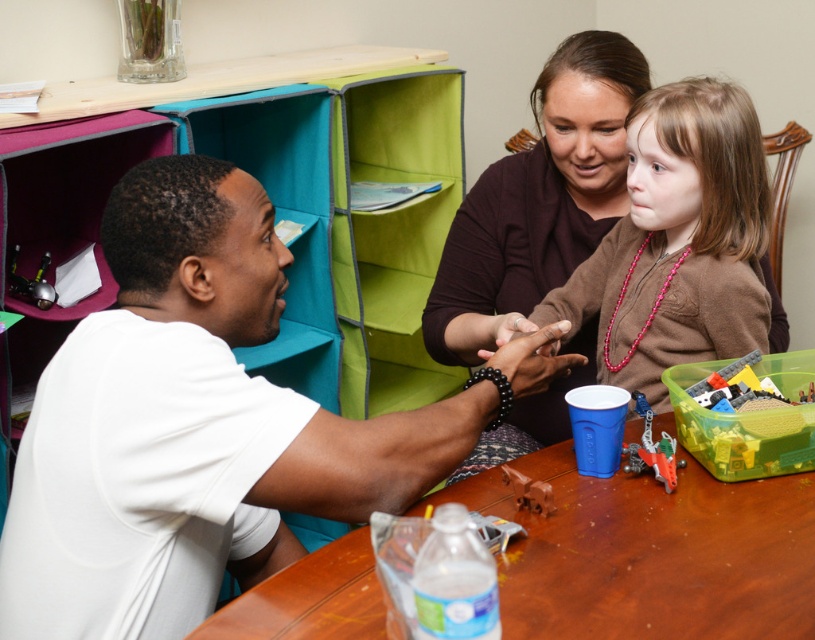
Measure the distance between point (664, 435) and camera.

Point (664, 435) and camera are 1.23 meters apart.

How much distance is there between metallic red toy airplane at lower center and brown matte horse at lower center?

A distance of 20.49 centimeters exists between metallic red toy airplane at lower center and brown matte horse at lower center.

Is point (635, 404) behind point (514, 472)?

Yes, point (635, 404) is behind point (514, 472).

Locate an element on the screen. metallic red toy airplane at lower center is located at coordinates (652, 449).

Does brown wooden table at center appear on the right side of translucent plastic container at lower right?

No, brown wooden table at center is not to the right of translucent plastic container at lower right.

Is brown wooden table at center shorter than translucent plastic container at lower right?

In fact, brown wooden table at center may be taller than translucent plastic container at lower right.

Locate an element on the screen. This screenshot has height=640, width=815. brown wooden table at center is located at coordinates (652, 552).

From the picture: Does brown matte sweater at center have a larger size compared to translucent plastic container at lower right?

Yes, brown matte sweater at center is bigger than translucent plastic container at lower right.

Is brown matte sweater at center positioned behind translucent plastic container at lower right?

Yes, brown matte sweater at center is behind translucent plastic container at lower right.

Locate an element on the screen. Image resolution: width=815 pixels, height=640 pixels. brown matte sweater at center is located at coordinates (677, 241).